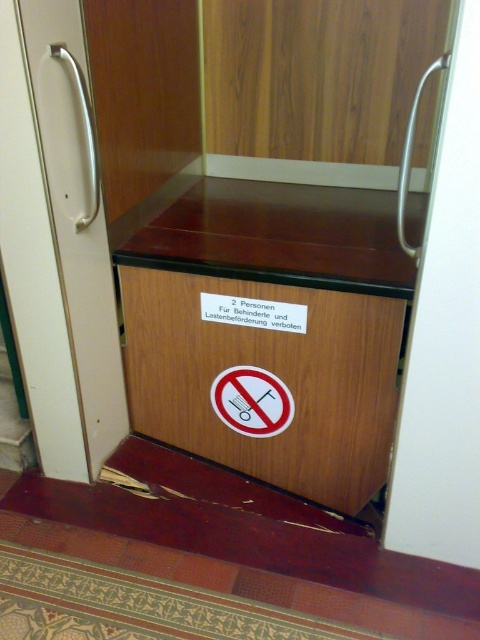
Based on the photo, you are standing in the elevator and want to reach both the point at coordinates (380,301) and the point at coordinates (96,419). Which point should you approach first to reach the closer one?

You should approach the point at coordinates (380,301) first because it is closer to you than the point at coordinates (96,419).

You are a maintenance worker needing to reach both the wooden drawer at center and the white glossy door handle at left. The tools you have are too large to fit in your pockets, so you can only carry one tool at a time. Which object should you reach first if you want to minimize the distance you walk between them?

You should reach the wooden drawer at center first because it is closer to the white glossy door handle at left, being only 17.34 inches apart. This way, you can work on both objects without moving far.